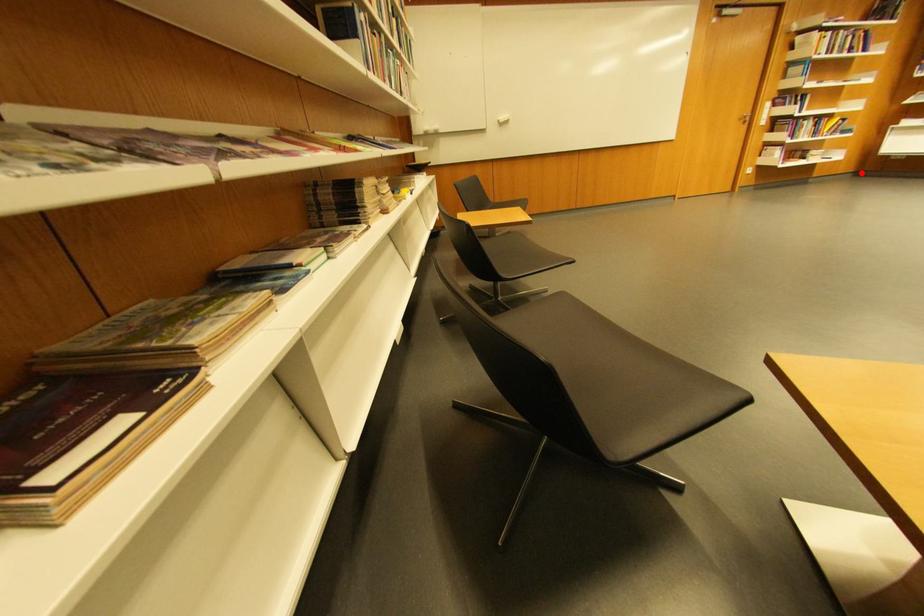
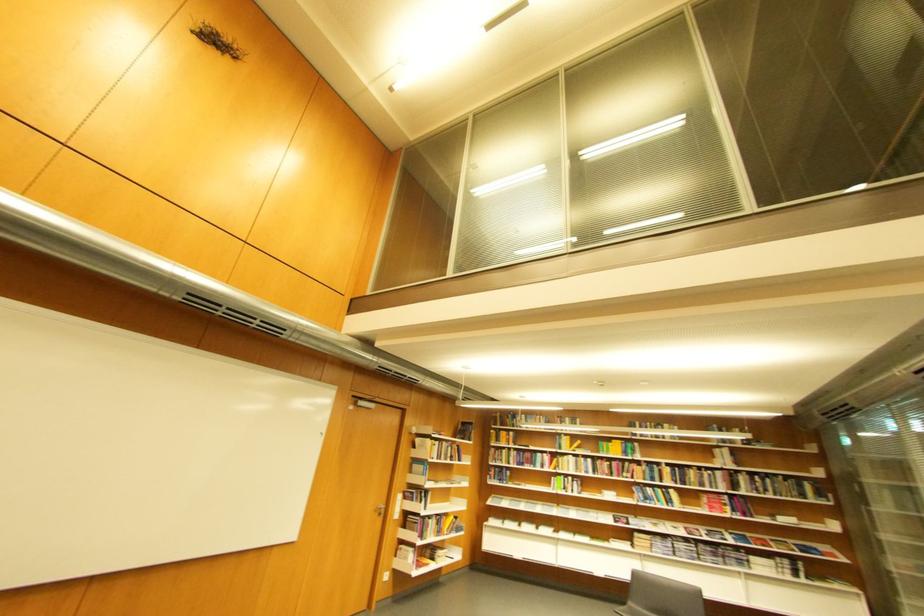
The point at the highlighted location is marked in the first image. Where is the corresponding point in the second image?

(479, 565)